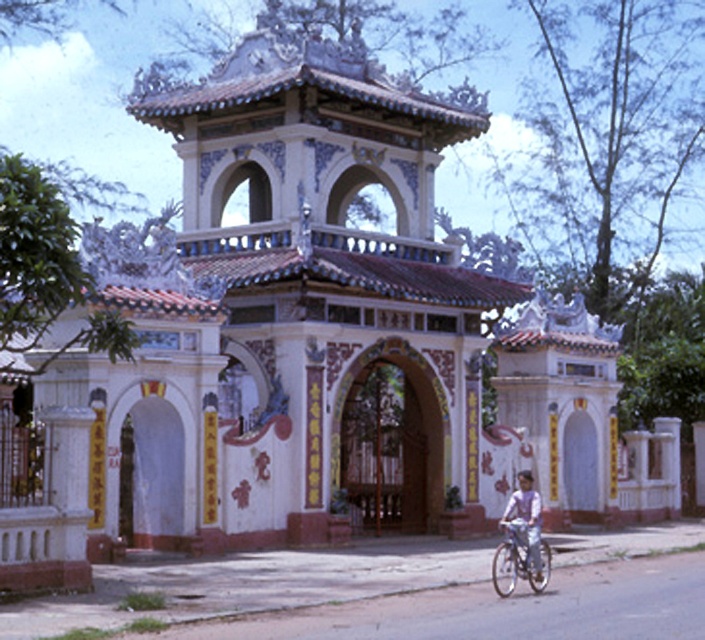
You are a photographer standing at the entrance of the East Asian gate. You want to take a photo that includes both the silver metallic bicycle at lower right and the light purple shirt at lower right. Which object should you frame closer to the camera to ensure both are visible in the shot?

You should frame the silver metallic bicycle at lower right closer to the camera because it is smaller than the light purple shirt at lower right, so bringing it forward will balance their sizes in the photo.

You are standing in front of the traditional East Asian gate and notice a person wearing a light purple shirt. Can you determine if the white painted stone archway at center is positioned higher or lower than the light purple shirt at lower right?

The white painted stone archway at center is located above the light purple shirt at lower right, so it is positioned higher than the light purple shirt at lower right.

You are standing in front of a traditional East Asian gate with intricate details. There is a point at coordinates point (539, 582). Considering your position, is this point closer to you or farther away than 40 meters?

The point (539, 582) is 37.67 meters away from the viewer, so it is closer than 40 meters.